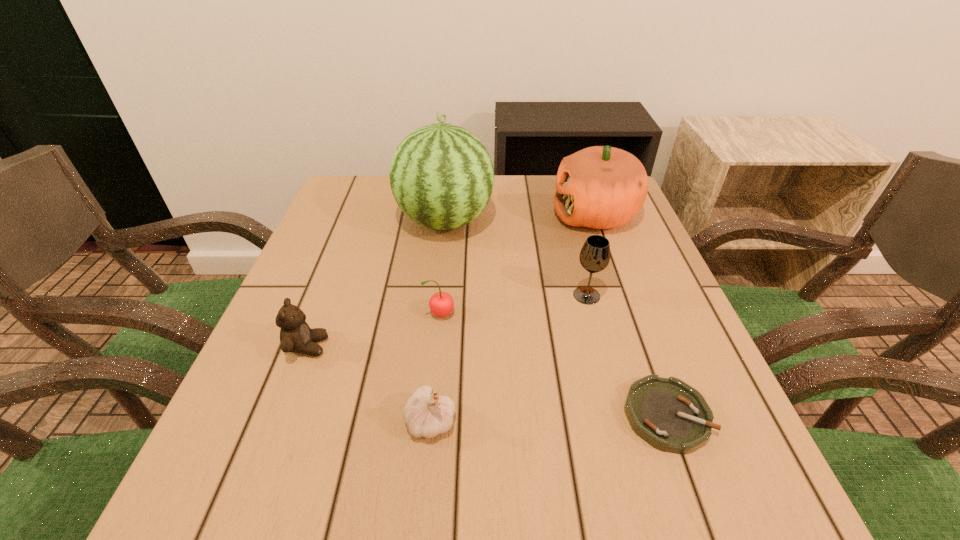
Find the location of a particular element. The width and height of the screenshot is (960, 540). vacant space at the near right corner of the desktop is located at coordinates (713, 524).

I want to click on free space between the tallest object and the fifth shortest object, so click(516, 258).

This screenshot has width=960, height=540. In order to click on unoccupied area between the watermelon and the garlic in this screenshot , I will do `click(438, 321)`.

The image size is (960, 540). Find the location of `free space between the pumpkin and the garlic`. free space between the pumpkin and the garlic is located at coordinates (513, 318).

At what (x,y) coordinates should I click in order to perform the action: click on blank region between the garlic and the fifth shortest object. Please return your answer as a coordinate pair (x, y). Looking at the image, I should click on (509, 359).

Find the location of a particular element. This screenshot has height=540, width=960. unoccupied area between the shortest object and the watermelon is located at coordinates (556, 319).

At what (x,y) coordinates should I click in order to perform the action: click on vacant area that lies between the wineglass and the cherry. Please return your answer as a coordinate pair (x, y). This screenshot has width=960, height=540. Looking at the image, I should click on (514, 305).

What are the coordinates of `unoccupied position between the teddy bear and the garlic` in the screenshot? It's located at pyautogui.click(x=369, y=384).

What are the coordinates of `vacant region between the shortest object and the fourth farthest object` in the screenshot? It's located at (553, 364).

I want to click on vacant space in between the ashtray and the third tallest object, so click(x=627, y=355).